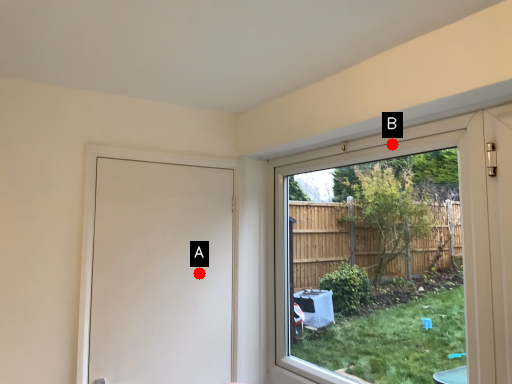
Question: Two points are circled on the image, labeled by A and B beside each circle. Among these points, which one is farthest from the camera?

Choices:
 (A) A is further
 (B) B is further

Answer: (A)